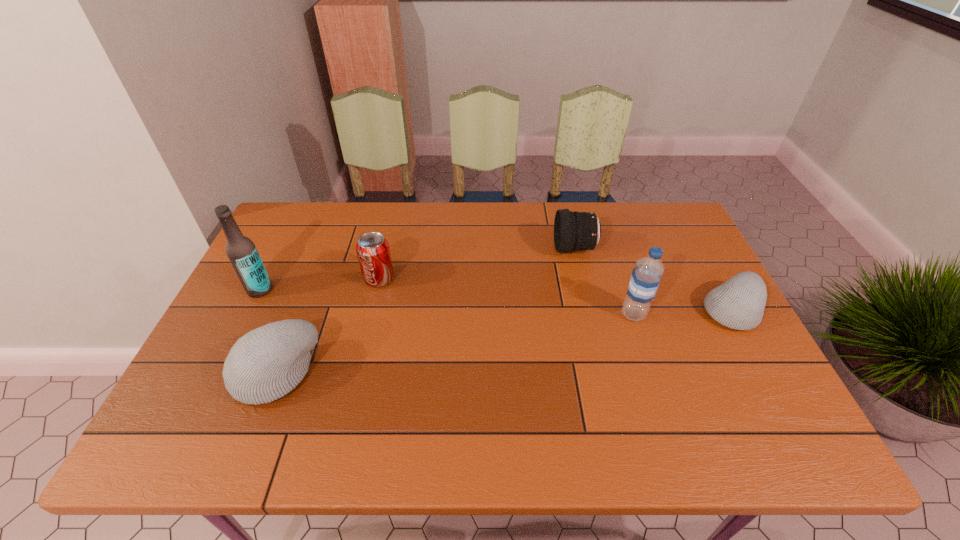
Identify the location of the nearest object. (265, 364).

This screenshot has height=540, width=960. I want to click on the taller beanie, so click(265, 364).

Find the location of a particular element. Image resolution: width=960 pixels, height=540 pixels. the shortest object is located at coordinates (739, 303).

Find the location of `the right beanie`. the right beanie is located at coordinates (739, 303).

Find the location of a particular element. Image resolution: width=960 pixels, height=540 pixels. the third object from right to left is located at coordinates (574, 231).

Image resolution: width=960 pixels, height=540 pixels. I want to click on telephoto lens, so click(x=574, y=231).

At what (x,y) coordinates should I click in order to perform the action: click on the second object from right to left. Please return your answer as a coordinate pair (x, y). The width and height of the screenshot is (960, 540). Looking at the image, I should click on (x=647, y=272).

Identify the location of water bottle. (647, 272).

Where is `soda can`? soda can is located at coordinates (373, 252).

Identify the location of the tallest object. (241, 251).